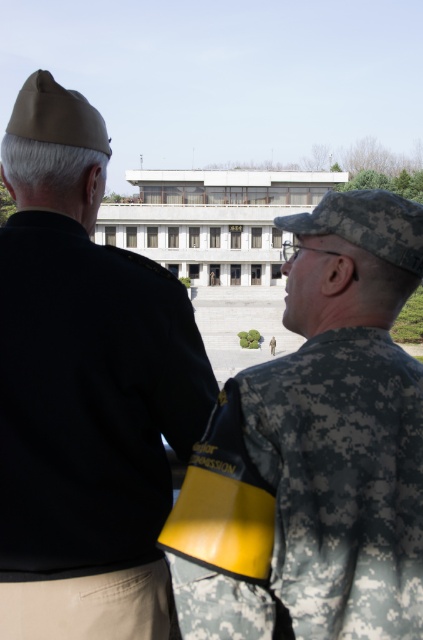
Question: Observing the image, what is the correct spatial positioning of black matte uniform at upper left in reference to camouflage uniform at center?

Choices:
 (A) below
 (B) above

Answer: (B)

Question: Does black matte uniform at upper left have a lesser width compared to camouflage uniform at center?

Choices:
 (A) yes
 (B) no

Answer: (A)

Question: Among these points, which one is nearest to the camera?

Choices:
 (A) (390, 452)
 (B) (148, 323)

Answer: (A)

Question: Is black matte uniform at upper left to the right of camouflage uniform at center from the viewer's perspective?

Choices:
 (A) no
 (B) yes

Answer: (A)